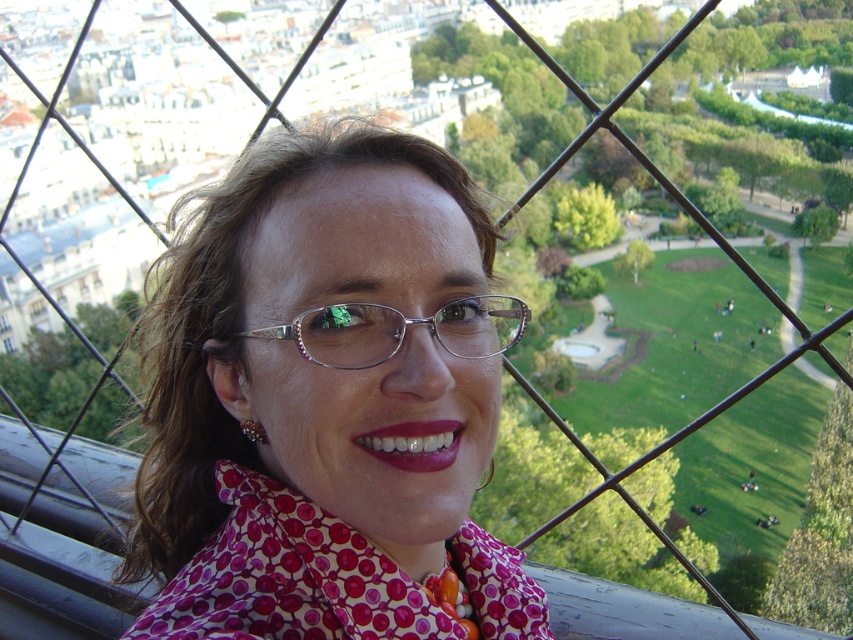
You are a photographer taking a portrait of the person in the metal framework. You notice the pink dotted shirt at center and the metallic silver glasses at center. Which object should you adjust to ensure the glasses are centered in the frame?

The pink dotted shirt at center is positioned on the left side of the metallic silver glasses at center. To center the glasses, you should move the pink dotted shirt at center to the right so that the metallic silver glasses at center is no longer offset to the right.

Based on the photo, you are a photographer trying to capture the best shot of the person in the metal framework. You notice a point at coordinates point (326, 403). Where exactly is this point located on the person?

The point (326, 403) is located on the pink dotted shirt at center.